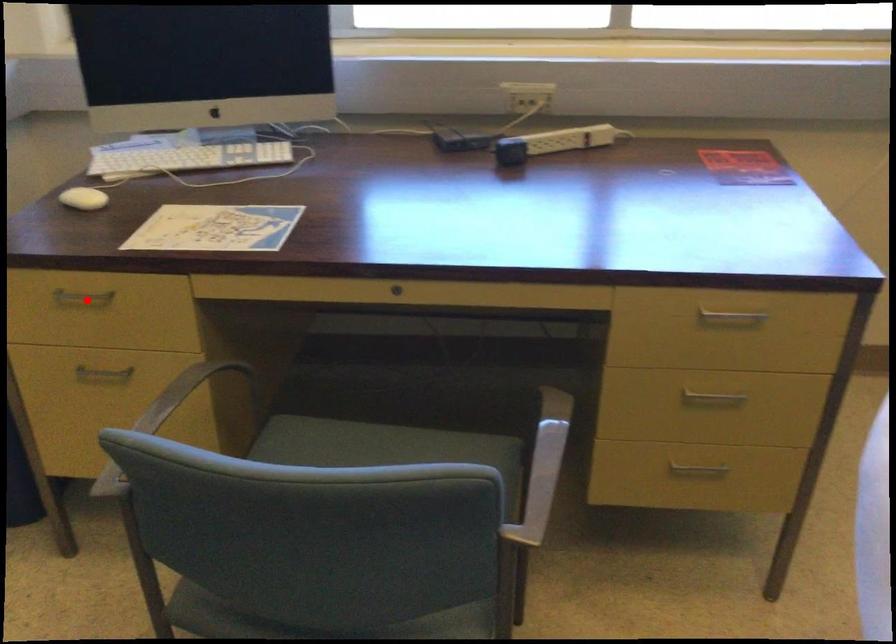
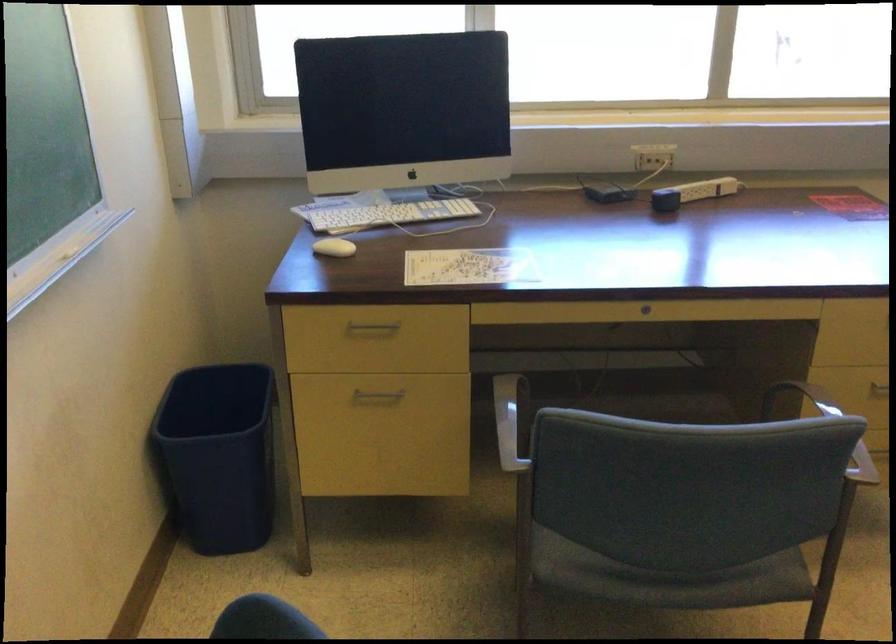
Locate, in the second image, the point that corresponds to the highlighted location in the first image.

(373, 327)